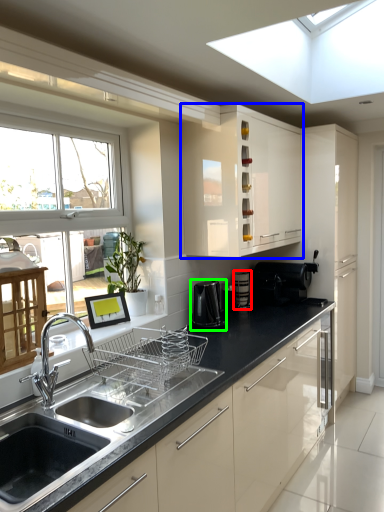
Question: Estimate the real-world distances between objects in this image. Which object is farther from appliance (highlighted by a red box), cabinetry (highlighted by a blue box) or coffee machine (highlighted by a green box)?

Choices:
 (A) cabinetry
 (B) coffee machine

Answer: (A)